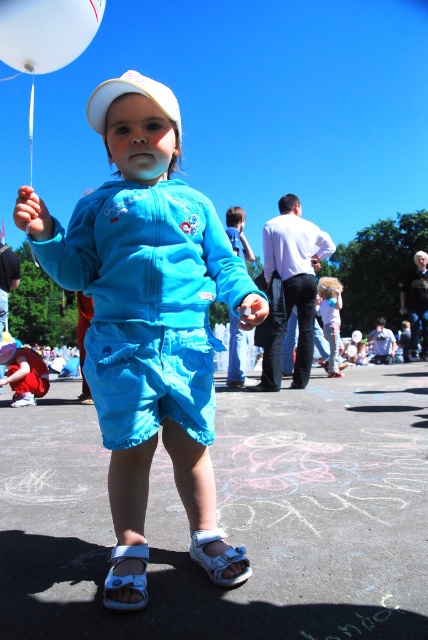
Is smooth asphalt at center above white fabric sandal at lower center?

Actually, smooth asphalt at center is below white fabric sandal at lower center.

In the scene shown: Is smooth asphalt at center thinner than white fabric sandal at lower center?

Incorrect, smooth asphalt at center's width is not less than white fabric sandal at lower center's.

Image resolution: width=428 pixels, height=640 pixels. What do you see at coordinates (231, 516) in the screenshot?
I see `smooth asphalt at center` at bounding box center [231, 516].

The height and width of the screenshot is (640, 428). I want to click on smooth asphalt at center, so click(x=231, y=516).

Can you confirm if matte blue jumpsuit at center is positioned above white glossy balloon at upper left?

Actually, matte blue jumpsuit at center is below white glossy balloon at upper left.

Is the position of matte blue jumpsuit at center more distant than that of white glossy balloon at upper left?

No, it is in front of white glossy balloon at upper left.

Between point (216, 234) and point (39, 20), which one is positioned behind?

The point (39, 20) is more distant.

This screenshot has width=428, height=640. Find the location of `matte blue jumpsuit at center`. matte blue jumpsuit at center is located at coordinates (146, 308).

Does white glossy balloon at upper left come behind blue denim shorts at center?

That is False.

Is point (5, 22) farther from camera compared to point (324, 330)?

No, (5, 22) is in front of (324, 330).

Where is `white glossy balloon at upper left`? white glossy balloon at upper left is located at coordinates (47, 32).